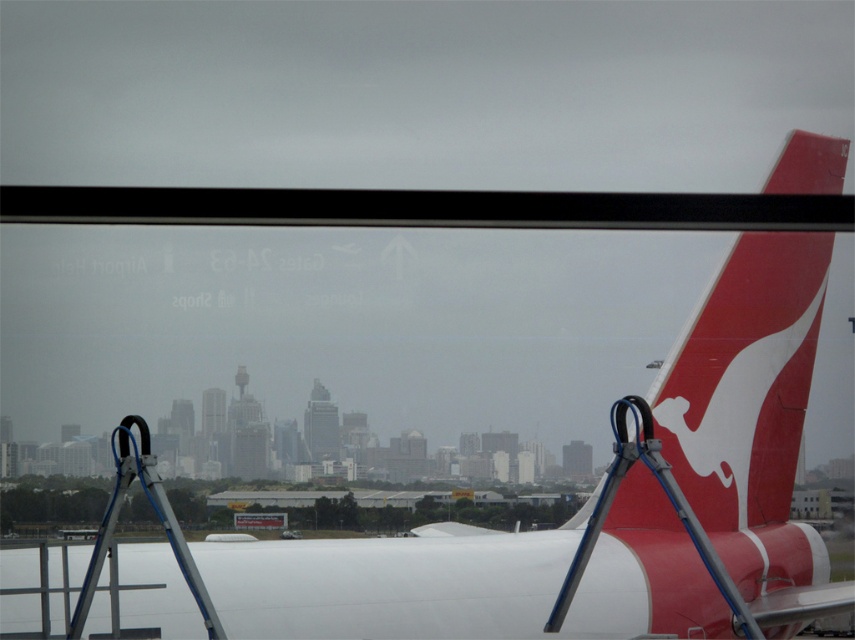
You are a maintenance worker needing to access the red matte airplane tail at right. You have a silver metallic ladder at center. Can the ladder reach the entire width of the tail if placed next to it?

The red matte airplane tail at right is wider than the silver metallic ladder at center, so the ladder cannot reach the entire width of the tail.

Looking at this image, you are a passenger sitting in the aircraft and want to take a photo of the red matte airplane tail at right from your seat. Based on its position, where should you aim your camera relative to the window?

The red matte airplane tail at right is located at the coordinates 0.595 on the x axis and 0.871 on the y axis, so you should aim your camera towards the lower right portion of the window to capture it.

You are a maintenance worker who needs to access the red matte airplane tail at right. You have the silver metallic ladder at center available. Considering their sizes, will the ladder be tall enough to reach the top of the tail?

The red matte airplane tail at right is larger than the silver metallic ladder at center, so the ladder may not be tall enough to reach the top of the tail.